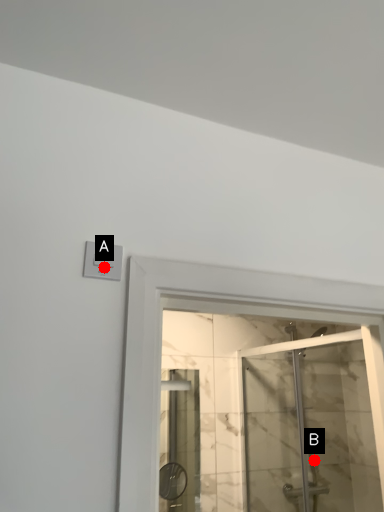
Question: Two points are circled on the image, labeled by A and B beside each circle. Which point is farther to the camera?

Choices:
 (A) A is further
 (B) B is further

Answer: (B)